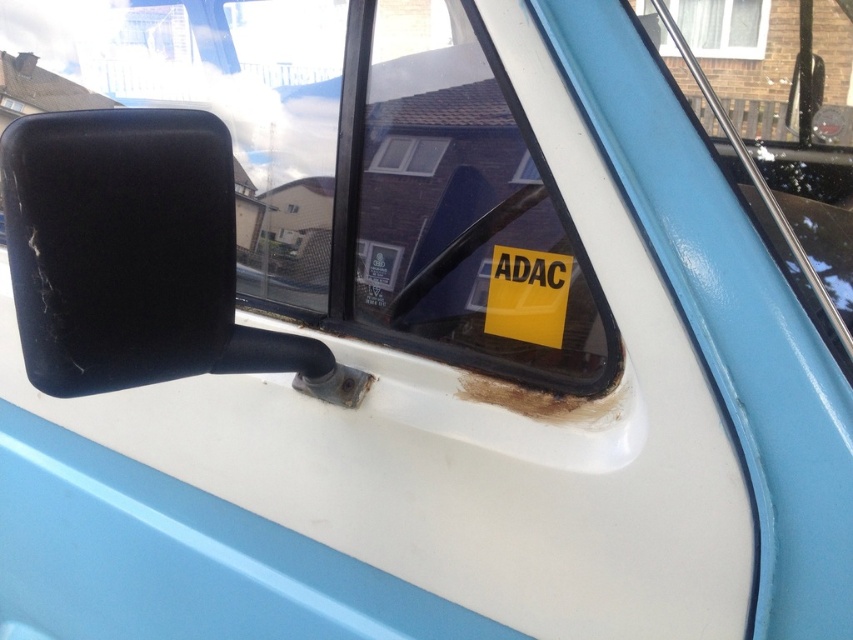
Question: Which object is positioned farthest from the transparent glass window at upper center?

Choices:
 (A) matte black mirror at left
 (B) clear glass window at upper center
 (C) transparent glass windshield at center

Answer: (B)

Question: Which of the following is the closest to the observer?

Choices:
 (A) clear glass window at upper center
 (B) matte black mirror at left
 (C) transparent glass windshield at center
 (D) transparent glass window at upper center

Answer: (B)

Question: In this image, where is transparent glass windshield at center located relative to clear glass window at upper center?

Choices:
 (A) left
 (B) right

Answer: (A)

Question: Is transparent glass windshield at center positioned in front of yellow paper at center?

Choices:
 (A) yes
 (B) no

Answer: (A)

Question: Is transparent glass windshield at center positioned at the back of transparent glass window at upper center?

Choices:
 (A) yes
 (B) no

Answer: (B)

Question: Which object appears farthest from the camera in this image?

Choices:
 (A) yellow paper at center
 (B) matte black mirror at left

Answer: (A)